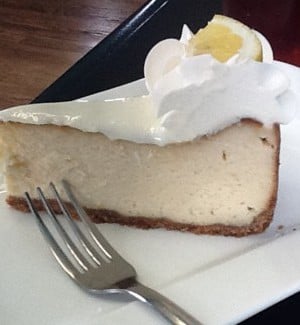
Find the location of a particular element. wooden table is located at coordinates (78, 30).